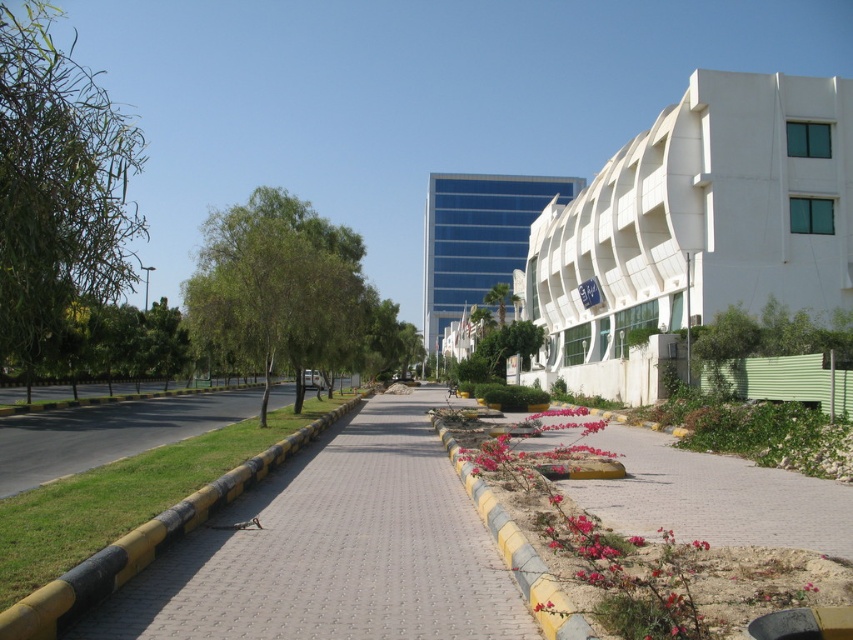
Which is more to the right, white smooth building at right or blue glass building at center?

From the viewer's perspective, white smooth building at right appears more on the right side.

Does white smooth building at right appear on the left side of blue glass building at center?

No, white smooth building at right is not to the left of blue glass building at center.

Measure the distance between point (763, 232) and camera.

A distance of 34.15 meters exists between point (763, 232) and camera.

This screenshot has height=640, width=853. Identify the location of white smooth building at right. (694, 230).

Is point (845, 285) behind point (548, 616)?

Yes, point (845, 285) is farther from viewer.

Is white smooth building at right bigger than yellow rubber curb at center?

Indeed, white smooth building at right has a larger size compared to yellow rubber curb at center.

Find the location of a particular element. white smooth building at right is located at coordinates (694, 230).

Image resolution: width=853 pixels, height=640 pixels. In order to click on white smooth building at right in this screenshot , I will do (694, 230).

Who is positioned more to the left, yellow rubber at lower left or yellow rubber curb at center?

Answer: yellow rubber at lower left

Does point (141, 541) come behind point (489, 490)?

No, (141, 541) is in front of (489, 490).

In order to click on yellow rubber at lower left in this screenshot , I will do `click(146, 541)`.